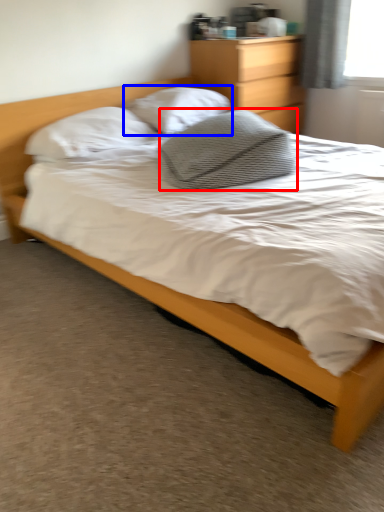
Question: Which point is further to the camera, pillow (highlighted by a red box) or pillow (highlighted by a blue box)?

Choices:
 (A) pillow
 (B) pillow

Answer: (B)